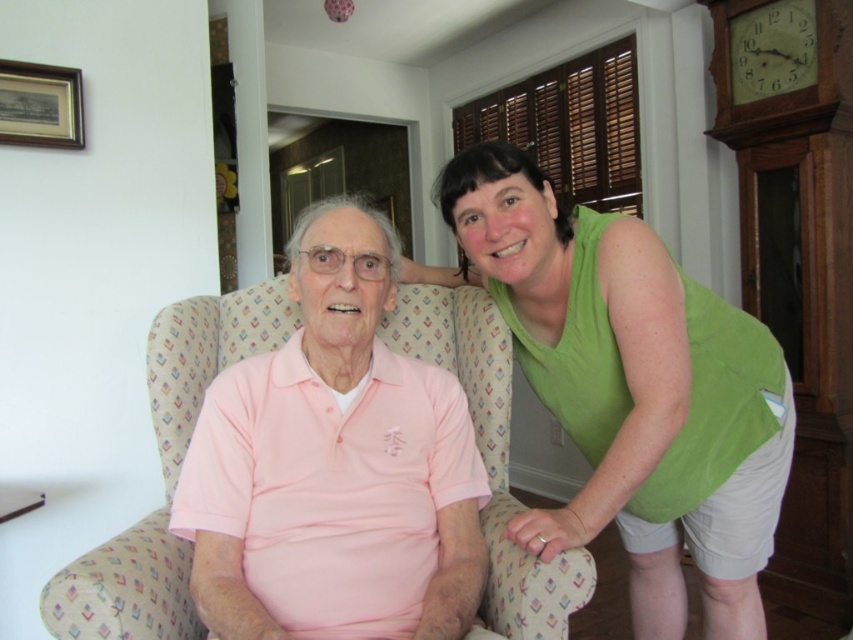
Question: Can you confirm if green sleeveless top at upper right is positioned to the right of pink fabric armchair at center?

Choices:
 (A) yes
 (B) no

Answer: (A)

Question: Which of the following is the farthest from the observer?

Choices:
 (A) pink fabric armchair at center
 (B) wooden clock at upper right

Answer: (B)

Question: Which point is farther from the camera taking this photo?

Choices:
 (A) (621, 346)
 (B) (93, 552)

Answer: (A)

Question: Is pink fabric armchair at center bigger than wooden clock at upper right?

Choices:
 (A) yes
 (B) no

Answer: (A)

Question: In this image, where is green sleeveless top at upper right located relative to pink fabric armchair at center?

Choices:
 (A) right
 (B) left

Answer: (A)

Question: Which object is the farthest from the pink fabric armchair at center?

Choices:
 (A) green sleeveless top at upper right
 (B) wooden clock at upper right

Answer: (B)